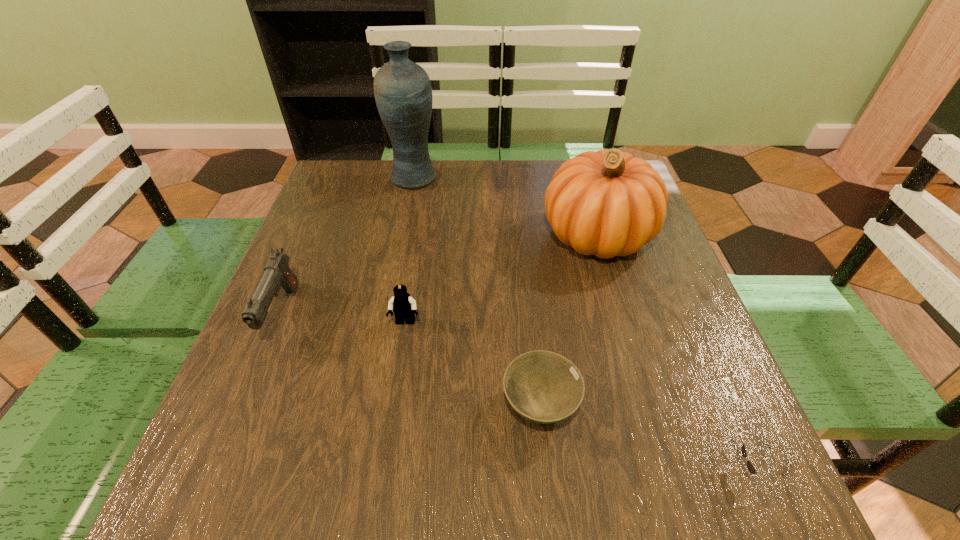
Locate which object ranks fourth in proximity to the tallest object. Please provide its 2D coordinates. Your answer should be formatted as a tuple, i.e. [(x, y)], where the tuple contains the x and y coordinates of a point satisfying the conditions above.

[(544, 387)]

You are a GUI agent. You are given a task and a screenshot of the screen. Output one action in this format:
    pyautogui.click(x=<x>, y=<y>)
    Task: Click on the object identified as the second closest to the bowl
    
    Given the screenshot: What is the action you would take?
    pyautogui.click(x=750, y=466)